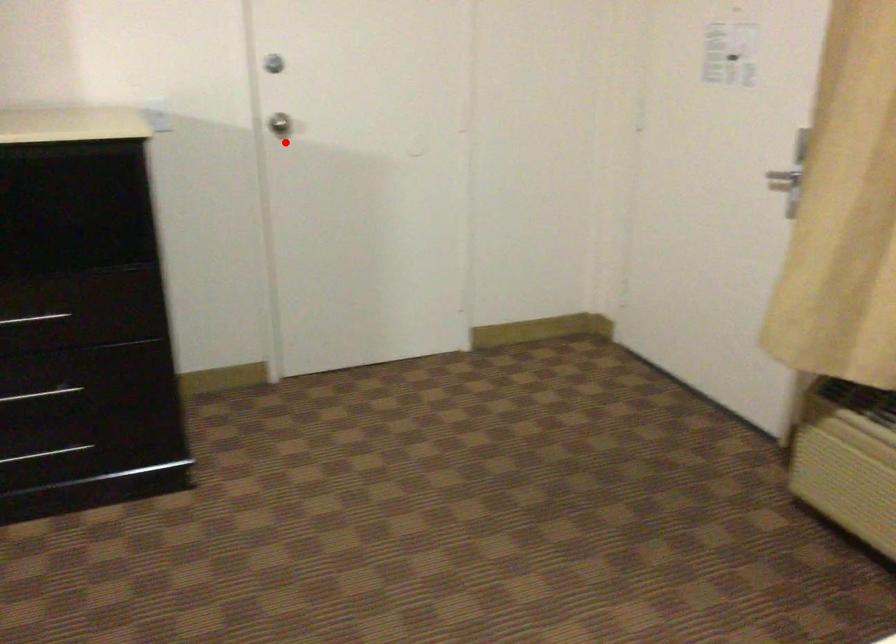
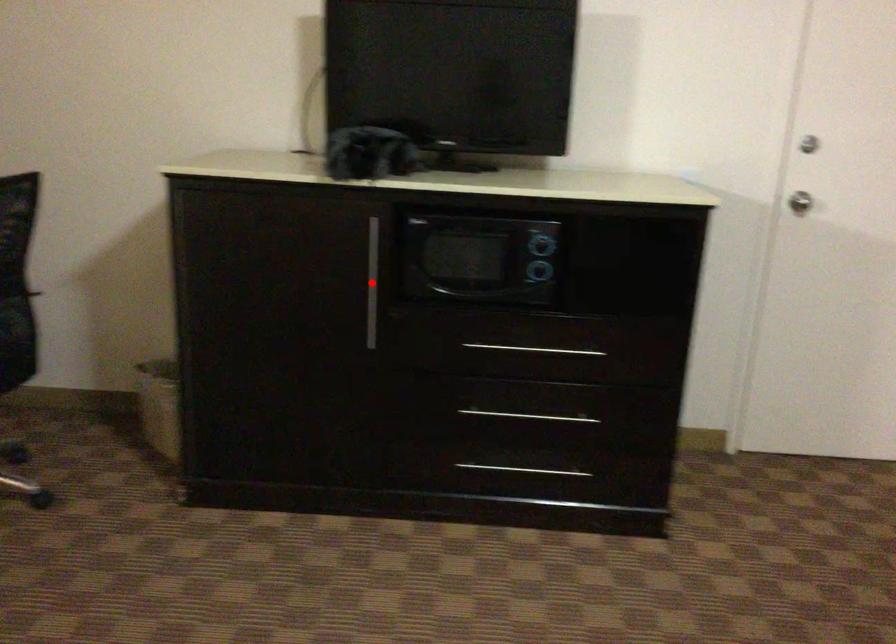
I am providing you with two images of the same scene from different viewpoints. A red point is marked on the first image and another point is marked on the second image. Do the highlighted points in image1 and image2 indicate the same real-world spot?

No